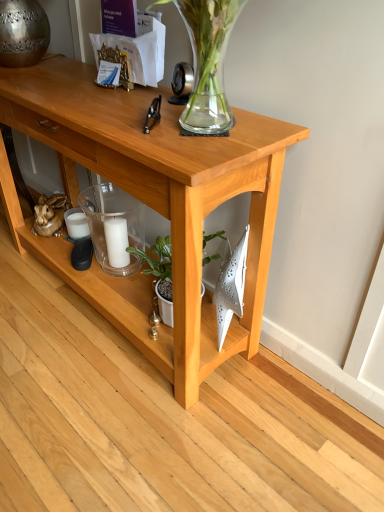
Image resolution: width=384 pixels, height=512 pixels. What are the coordinates of `vacant space in front of light wood table at center` in the screenshot? It's located at (112, 413).